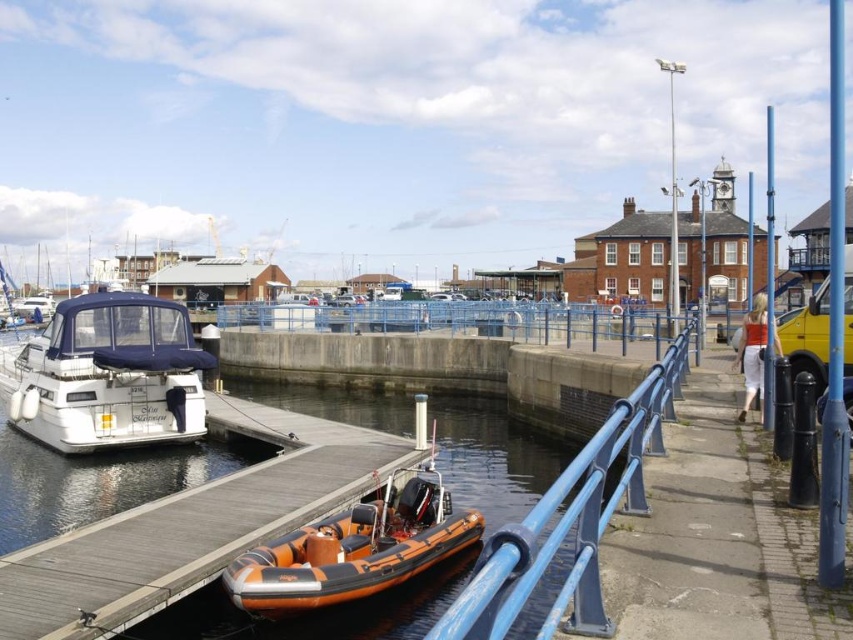
Question: Which of the following is the farthest from the observer?

Choices:
 (A) white matte boat at left
 (B) blue metallic rail at center
 (C) orange rubber boat at lower center

Answer: (A)

Question: Considering the relative positions of blue metallic rail at center and orange rubber boat at lower center in the image provided, where is blue metallic rail at center located with respect to orange rubber boat at lower center?

Choices:
 (A) above
 (B) below

Answer: (A)

Question: Among these objects, which one is farthest from the camera?

Choices:
 (A) orange rubber boat at lower center
 (B) blue metallic rail at center

Answer: (A)

Question: Among these points, which one is farthest from the camera?

Choices:
 (A) (169, 317)
 (B) (418, 404)
 (C) (564, 474)

Answer: (A)

Question: Can you confirm if blue metallic rail at center is bigger than orange rubber boat at lower center?

Choices:
 (A) yes
 (B) no

Answer: (A)

Question: Is white matte boat at left closer to camera compared to orange rubber boat at lower center?

Choices:
 (A) no
 (B) yes

Answer: (A)